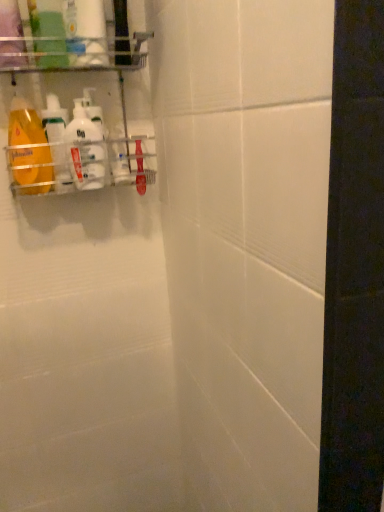
Question: Is white glossy bottle at upper left, the fifth cleaning product in the left-to-right sequence, a part of white glossy bottle at left, the 3th cleaning product positioned from the right?

Choices:
 (A) yes
 (B) no

Answer: (B)

Question: Considering the relative sizes of white glossy bottle at left, which is the 3th cleaning product in left-to-right order, and white glossy bottle at upper left, the first cleaning product from the right, in the image provided, is white glossy bottle at left, which is the 3th cleaning product in left-to-right order, shorter than white glossy bottle at upper left, the first cleaning product from the right,?

Choices:
 (A) no
 (B) yes

Answer: (B)

Question: Is white glossy bottle at left, the 3th cleaning product positioned from the right, outside of white glossy bottle at upper left, the first cleaning product from the right?

Choices:
 (A) no
 (B) yes

Answer: (B)

Question: Does white glossy bottle at left, which is the 3th cleaning product in left-to-right order, come behind white glossy bottle at upper left, the fifth cleaning product in the left-to-right sequence?

Choices:
 (A) yes
 (B) no

Answer: (B)

Question: Does white glossy bottle at left, the 3th cleaning product positioned from the right, turn towards white glossy bottle at upper left, the first cleaning product from the right?

Choices:
 (A) no
 (B) yes

Answer: (A)

Question: Does white glossy bottle at left, the 3th cleaning product positioned from the right, have a lesser width compared to white glossy bottle at upper left, the fifth cleaning product in the left-to-right sequence?

Choices:
 (A) yes
 (B) no

Answer: (B)

Question: Could metallic silver rack at upper left be considered to be inside matte orange bottle at left, the 1th cleaning product in the left-to-right sequence?

Choices:
 (A) yes
 (B) no

Answer: (B)

Question: Is the depth of matte orange bottle at left, the 1th cleaning product in the left-to-right sequence, greater than that of metallic silver rack at upper left?

Choices:
 (A) yes
 (B) no

Answer: (A)

Question: From a real-world perspective, is matte orange bottle at left, the 1th cleaning product in the left-to-right sequence, on top of metallic silver rack at upper left?

Choices:
 (A) no
 (B) yes

Answer: (A)

Question: Does matte orange bottle at left, the 1th cleaning product in the left-to-right sequence, have a greater width compared to metallic silver rack at upper left?

Choices:
 (A) yes
 (B) no

Answer: (B)

Question: Is matte orange bottle at left, which is the fifth cleaning product in right-to-left order, touching metallic silver rack at upper left?

Choices:
 (A) no
 (B) yes

Answer: (A)

Question: From the image's perspective, is matte orange bottle at left, which is the fifth cleaning product in right-to-left order, on top of metallic silver rack at upper left?

Choices:
 (A) no
 (B) yes

Answer: (A)

Question: Is white glossy bottle at upper left, the first cleaning product from the right, bigger than white glossy bottle at upper left, the fourth cleaning product when ordered from left to right?

Choices:
 (A) yes
 (B) no

Answer: (B)